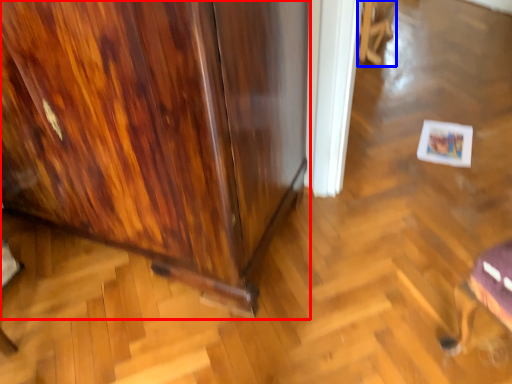
Question: Among these objects, which one is farthest to the camera, furniture (highlighted by a red box) or swivel chair (highlighted by a blue box)?

Choices:
 (A) furniture
 (B) swivel chair

Answer: (B)